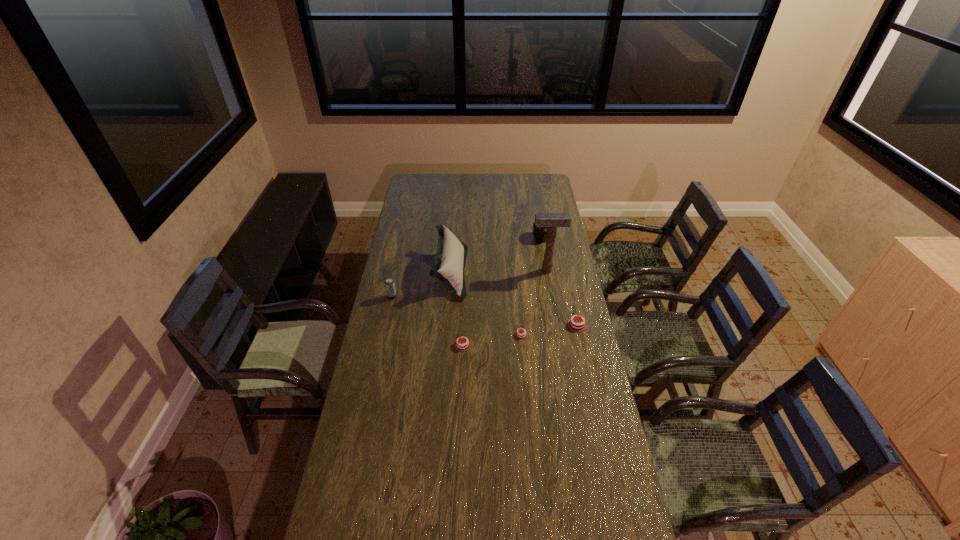
Locate an element on the screen. The width and height of the screenshot is (960, 540). the leftmost chocolate cake is located at coordinates (462, 345).

Locate an element on the screen. The image size is (960, 540). the sixth tallest object is located at coordinates (462, 345).

Where is `the second chocolate cake from left to right`? the second chocolate cake from left to right is located at coordinates (519, 334).

Where is `the shortest object`? the shortest object is located at coordinates (519, 334).

This screenshot has width=960, height=540. I want to click on the rightmost chocolate cake, so click(574, 325).

Where is `the tallest chocolate cake`? The height and width of the screenshot is (540, 960). the tallest chocolate cake is located at coordinates (574, 325).

What are the coordinates of `the farthest object` in the screenshot? It's located at (540, 233).

Where is `cushion`? This screenshot has width=960, height=540. cushion is located at coordinates (451, 254).

The height and width of the screenshot is (540, 960). Find the location of `the tallest object`. the tallest object is located at coordinates (551, 220).

The height and width of the screenshot is (540, 960). What are the coordinates of `the leftmost object` in the screenshot? It's located at (389, 283).